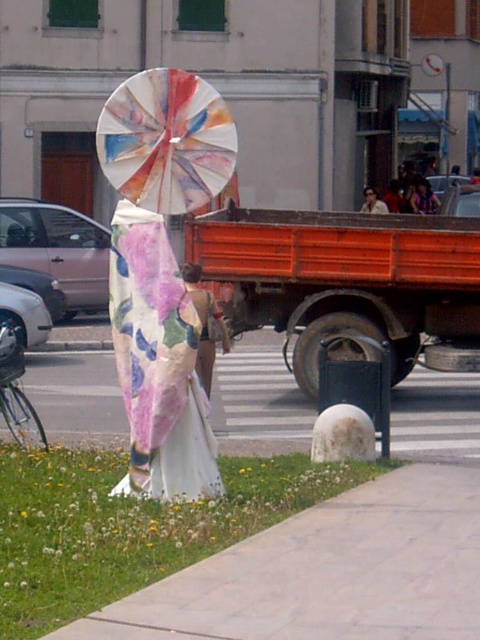
Describe the element at coordinates (167, 140) in the screenshot. I see `painted paper umbrella at center` at that location.

Locate an element on the screen. This screenshot has width=480, height=640. painted paper umbrella at center is located at coordinates (167, 140).

The width and height of the screenshot is (480, 640). Identify the location of painted paper umbrella at center. (167, 140).

Who is shorter, floral silk dress at center or matte pink dress at upper right?

matte pink dress at upper right

Is point (132, 211) closer to viewer compared to point (421, 204)?

Yes, point (132, 211) is in front of point (421, 204).

The height and width of the screenshot is (640, 480). I want to click on floral silk dress at center, so click(x=157, y=364).

Which of these two, white stone pavement at lower right or floral silk dress at center, stands shorter?

With less height is white stone pavement at lower right.

Where is `white stone pavement at lower right`? This screenshot has height=640, width=480. white stone pavement at lower right is located at coordinates (327, 572).